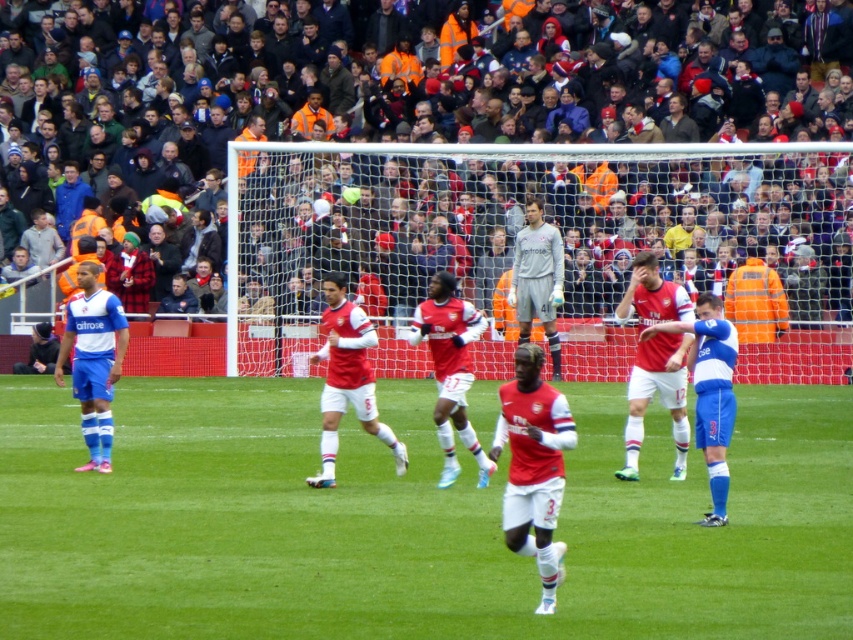
You are a soccer player on the red team. You see the matte red soccer ball at center and the gray matte jersey at center. Which object is closer to you if you are positioned at the front of the pitch?

The matte red soccer ball at center is closer to you because it is in front of the gray matte jersey at center.

You are a photographer at the soccer match and want to capture both the matte red jersey at center and the blue jersey at left in a single shot. Which jersey should you focus on first to ensure both are in frame?

The matte red jersey at center has a smaller size compared to blue jersey at left, so you should focus on the blue jersey at left first to ensure both are in frame.

You are a soccer coach analyzing the game. You notice a point marked at coordinates (659, 397) on the field. What is the nearest object to this point?

The point at (659, 397) marks the location of the matte red jersey at center, so the nearest object to this point is the matte red jersey at center.